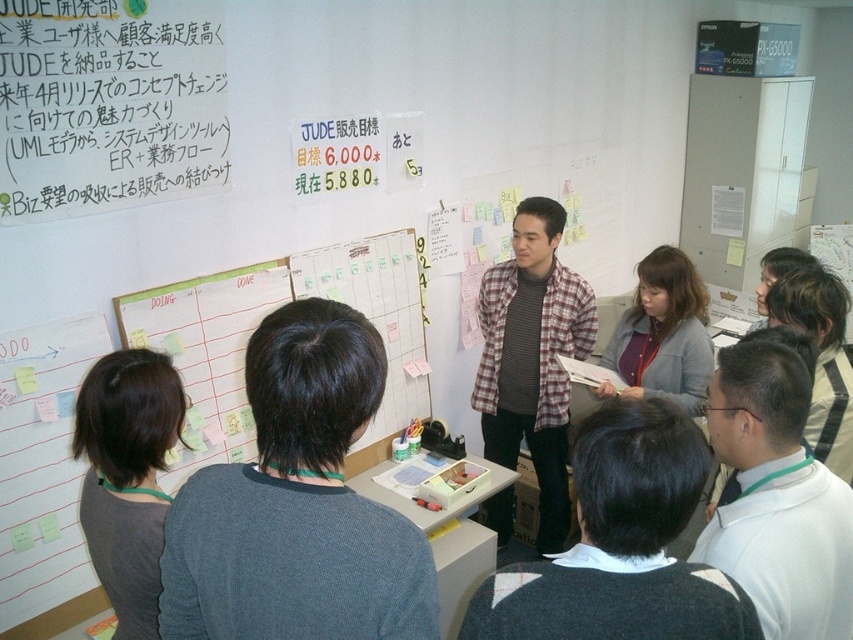
Question: Can you confirm if matte white paper at upper left is thinner than dark gray sweater at lower left?

Choices:
 (A) no
 (B) yes

Answer: (A)

Question: Is dark gray sweater at center further to camera compared to matte white paper at upper left?

Choices:
 (A) no
 (B) yes

Answer: (A)

Question: Which is farther from the dark gray sweater at center?

Choices:
 (A) gray sweater at center
 (B) dark gray sweater at lower left
 (C) matte white paper at upper left

Answer: (A)

Question: Is matte white paper at upper left further to the viewer compared to white matte shirt at center?

Choices:
 (A) yes
 (B) no

Answer: (A)

Question: Among these objects, which one is nearest to the camera?

Choices:
 (A) white matte shirt at center
 (B) gray sweater at center
 (C) dark gray sweater at lower left

Answer: (A)

Question: Estimate the real-world distances between objects in this image. Which object is farther from the dark gray sweater at center?

Choices:
 (A) dark gray sweater at lower left
 (B) gray sweater at center
 (C) matte white paper at upper left

Answer: (B)